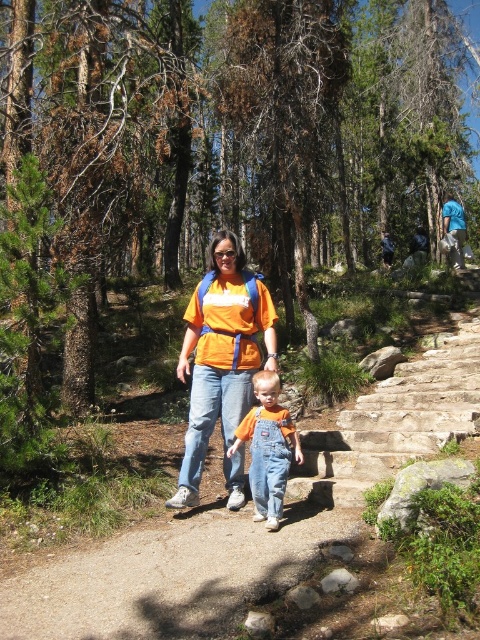
You are standing at the point marked by the coordinates in the image. The smooth concrete path at center is represented by point (x=241, y=525). Which direction should you walk to stay on the smooth concrete path at center?

The smooth concrete path at center is represented by point (x=241, y=525), so you should walk in the direction of the path indicated by this coordinate to stay on it.